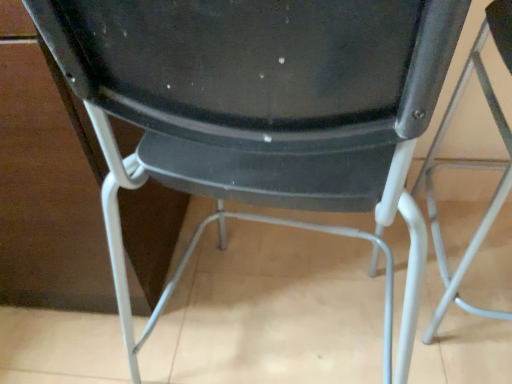
You are a GUI agent. You are given a task and a screenshot of the screen. Output one action in this format:
    pyautogui.click(x=<x>, y=<y>)
    Task: Click on the metallic gray chair at right
    This screenshot has height=384, width=512.
    Given the screenshot: What is the action you would take?
    pyautogui.click(x=471, y=161)

In the scene shown: Measure the distance between metallic gray chair at right and camera.

metallic gray chair at right and camera are 75.01 centimeters apart.

The image size is (512, 384). What do you see at coordinates (471, 161) in the screenshot?
I see `metallic gray chair at right` at bounding box center [471, 161].

Image resolution: width=512 pixels, height=384 pixels. In order to click on metallic gray chair at right in this screenshot , I will do `click(471, 161)`.